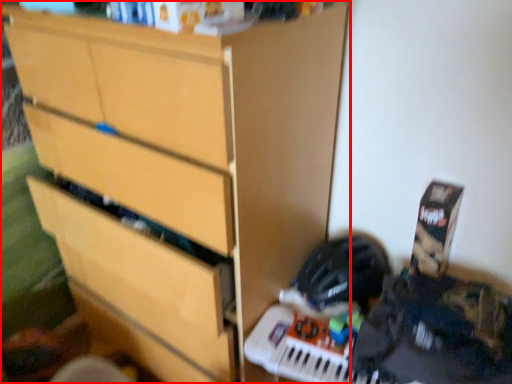
Question: Where is chest of drawers (annotated by the red box) located in relation to helmet in the image?

Choices:
 (A) left
 (B) right

Answer: (A)